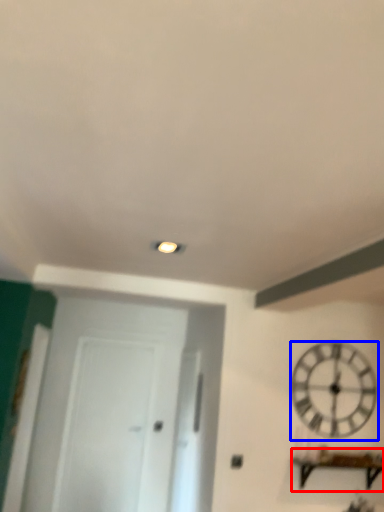
Question: Among these objects, which one is farthest to the camera, furniture (highlighted by a red box) or wall clock (highlighted by a blue box)?

Choices:
 (A) furniture
 (B) wall clock

Answer: (B)